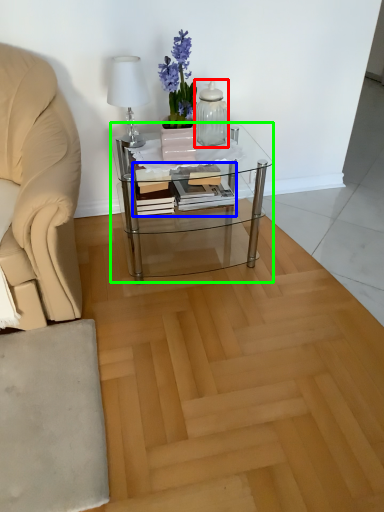
Question: Which object is positioned farthest from glass vase (highlighted by a red box)? Select from book (highlighted by a blue box) and coffee table (highlighted by a green box).

Choices:
 (A) book
 (B) coffee table

Answer: (B)